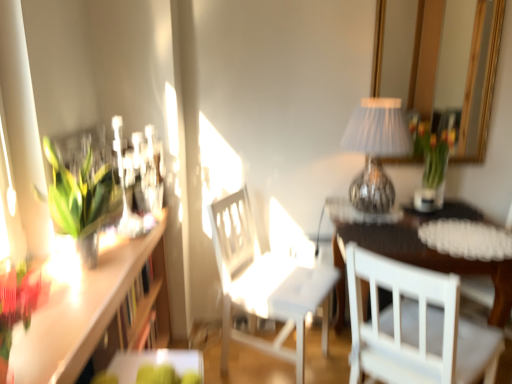
Question: Is translucent glass vase with tulips at upper right positioned with its back to white matte chair at center, the 2th chair in the right-to-left sequence?

Choices:
 (A) no
 (B) yes

Answer: (A)

Question: Is translucent glass vase with tulips at upper right to the left of white matte chair at center, arranged as the first chair when viewed from the left, from the viewer's perspective?

Choices:
 (A) yes
 (B) no

Answer: (B)

Question: Can you confirm if translucent glass vase with tulips at upper right is positioned to the right of white matte chair at center, arranged as the first chair when viewed from the left?

Choices:
 (A) no
 (B) yes

Answer: (B)

Question: Is translucent glass vase with tulips at upper right far from white matte chair at center, arranged as the first chair when viewed from the left?

Choices:
 (A) yes
 (B) no

Answer: (B)

Question: Is translucent glass vase with tulips at upper right oriented towards white matte chair at center, arranged as the first chair when viewed from the left?

Choices:
 (A) no
 (B) yes

Answer: (A)

Question: Could white matte chair at center, the 2th chair in the right-to-left sequence, be considered to be inside translucent glass vase with tulips at upper right?

Choices:
 (A) no
 (B) yes

Answer: (A)

Question: Is translucent glass vase with tulips at upper right next to silver pleated lampshade at upper right?

Choices:
 (A) no
 (B) yes

Answer: (A)

Question: From the image's perspective, is translucent glass vase with tulips at upper right below silver pleated lampshade at upper right?

Choices:
 (A) yes
 (B) no

Answer: (A)

Question: From a real-world perspective, is translucent glass vase with tulips at upper right physically above silver pleated lampshade at upper right?

Choices:
 (A) yes
 (B) no

Answer: (B)

Question: Can you confirm if translucent glass vase with tulips at upper right is taller than silver pleated lampshade at upper right?

Choices:
 (A) yes
 (B) no

Answer: (B)

Question: Does translucent glass vase with tulips at upper right lie behind silver pleated lampshade at upper right?

Choices:
 (A) yes
 (B) no

Answer: (A)

Question: Does translucent glass vase with tulips at upper right have a lesser height compared to silver pleated lampshade at upper right?

Choices:
 (A) no
 (B) yes

Answer: (B)

Question: From the image's perspective, is green plastic tray at lower center, the first table when ordered from left to right, located beneath silver pleated lampshade at upper right?

Choices:
 (A) yes
 (B) no

Answer: (A)